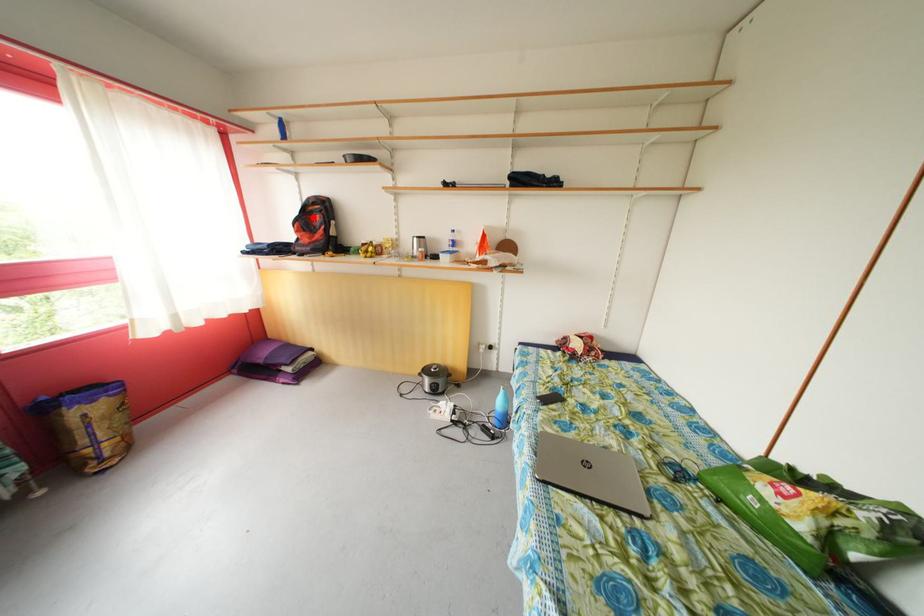
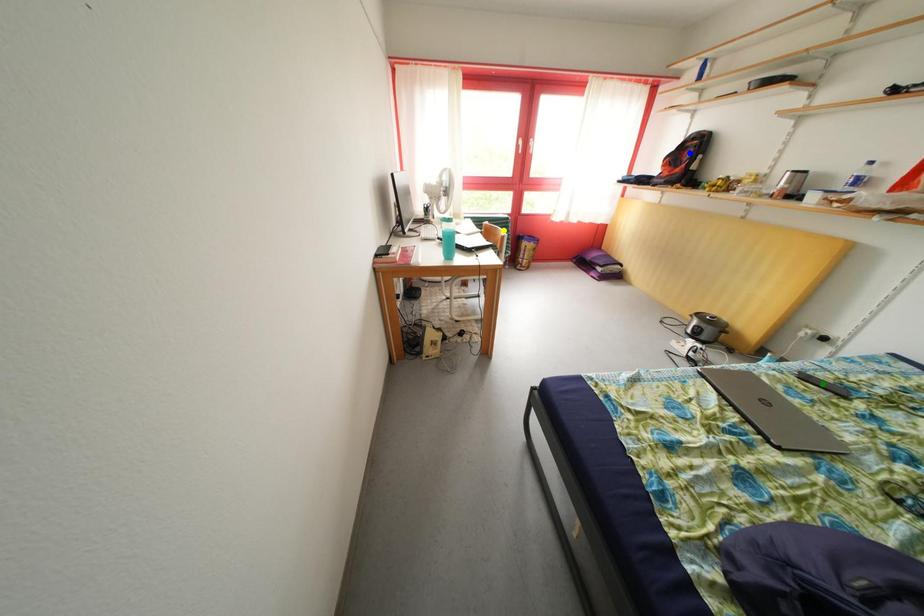
Question: I am providing you with two images of the same scene from different viewpoints. A red point is marked on the first image. You are given multiple points on the second image. Can you choose the point in image 2 that corresponds to the point in image 1?

Choices:
 (A) green point
 (B) yellow point
 (C) blue point

Answer: (C)